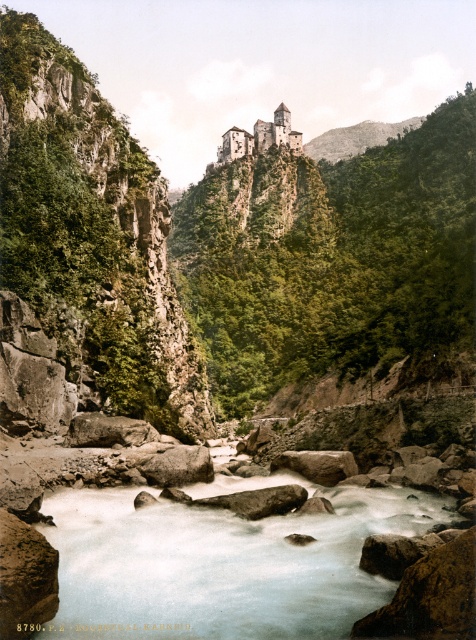
You are an adventurer planning to cross the river using a small wooden bridge. You need to know if the smooth rock river at center is higher than the green rocky mountain at upper center to determine the bridge height. Can you tell me which one is taller?

The smooth rock river at center has a lesser height compared to the green rocky mountain at upper center, so the mountain is taller. Therefore, the bridge should be built to accommodate the mountain height.

Looking at this image, you are a hiker planning to reach the brown stone castle at upper center. You notice the green rocky mountain at upper center in the same area. Which structure would you need to climb first to reach your destination?

You would need to climb the green rocky mountain at upper center first since it is bigger than the brown stone castle at upper center and likely forms the base upon which the castle is built.

You are a hiker navigating the valley and notice two landmarks marked as point A and point B on your map. Point A corresponds to point (385, 134) and point B corresponds to point (275, 113). Which point is closer to your current position if you are standing at the riverbank near the foreground?

Point B is closer because point A is behind point B, so when standing at the riverbank near the foreground, point B would be nearer to you than point A.